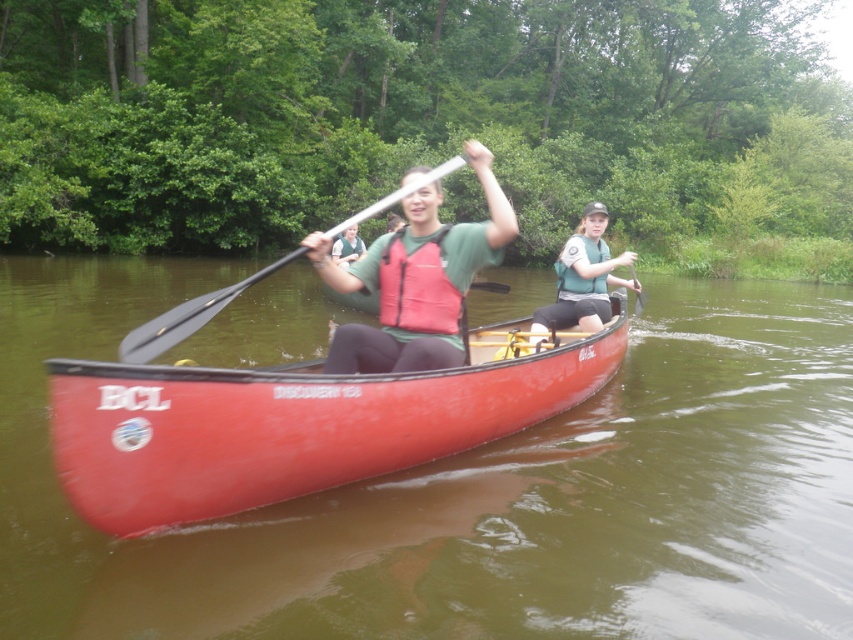
Between point (544, 321) and point (224, 304), which one is positioned in front?

Point (224, 304) is more forward.

Between green matte life vest at center and black plastic paddle at center, which one is positioned lower?

green matte life vest at center is below.

Who is more forward, [590,296] or [228,300]?

Positioned in front is point [228,300].

Identify the location of green matte life vest at center. (583, 278).

Measure the distance from matte green life vest at center to green matte life vest at center.

The distance of matte green life vest at center from green matte life vest at center is 3.10 meters.

Does matte green life vest at center have a lesser height compared to green matte life vest at center?

No, matte green life vest at center is not shorter than green matte life vest at center.

Does point (408, 301) come closer to viewer compared to point (579, 244)?

Yes, point (408, 301) is in front of point (579, 244).

At what (x,y) coordinates should I click in order to perform the action: click on matte green life vest at center. Please return your answer as a coordinate pair (x, y). The image size is (853, 640). Looking at the image, I should click on (416, 280).

Does red smooth canoe at center have a smaller size compared to green fabric life vest at center?

No, red smooth canoe at center is not smaller than green fabric life vest at center.

Identify the location of red smooth canoe at center. (474, 490).